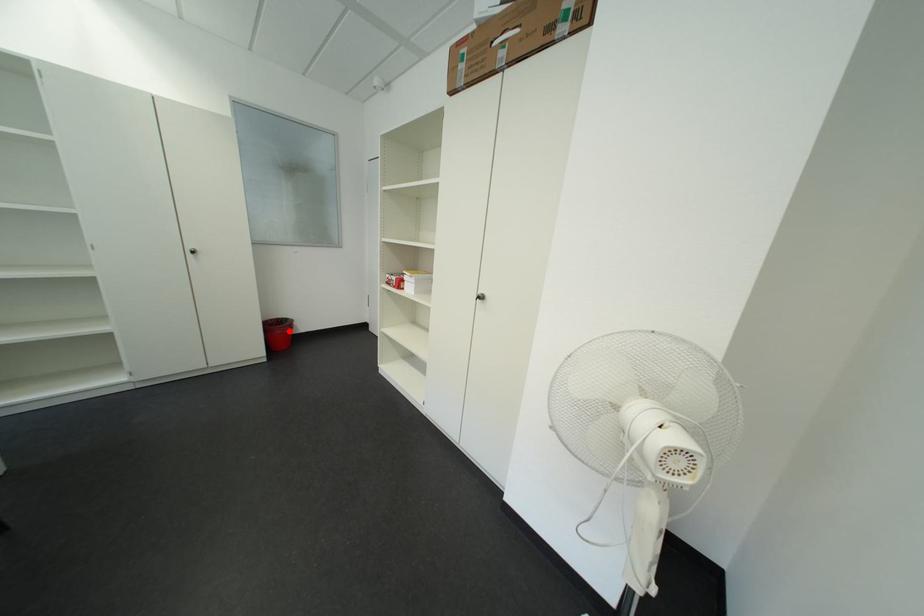
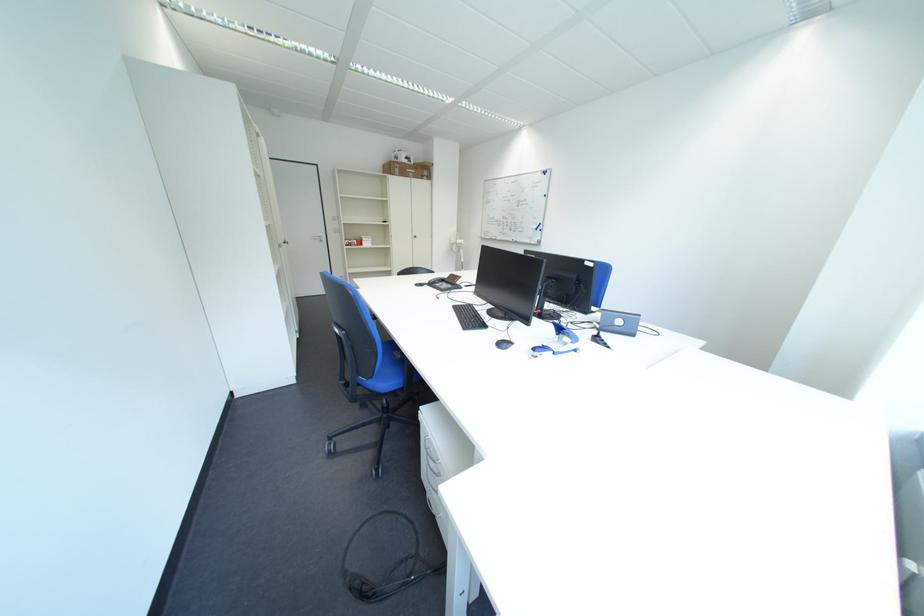
Question: I am providing you with two images of the same scene from different viewpoints. A red point is marked on the first image. At the location where the point appears in image 1, is it still visible in image 2?

Choices:
 (A) Yes
 (B) No

Answer: (B)